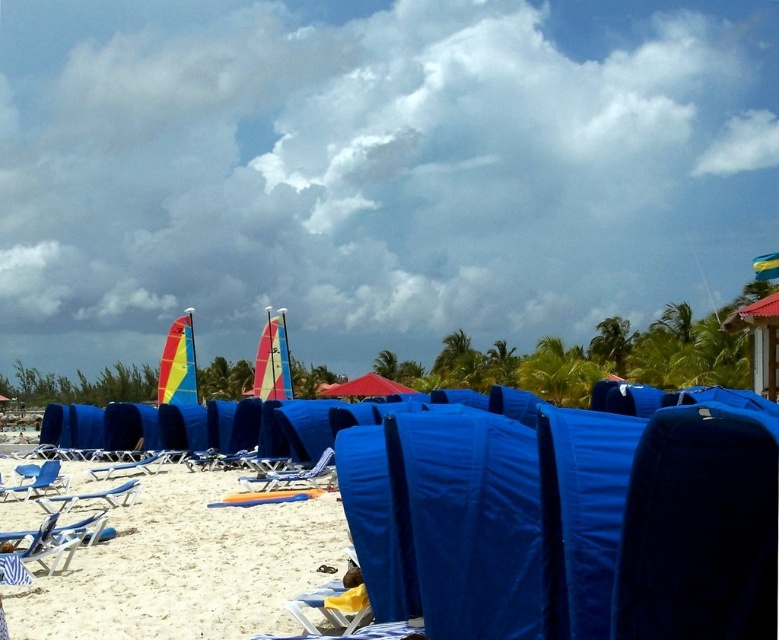
Looking at this image, can you confirm if white sandy beach at lower center is bigger than metallic blue lounge chair at center?

No, white sandy beach at lower center is not bigger than metallic blue lounge chair at center.

Who is positioned more to the left, white sandy beach at lower center or metallic blue lounge chair at center?

metallic blue lounge chair at center is more to the left.

Identify the location of white sandy beach at lower center. pyautogui.click(x=185, y=566).

The width and height of the screenshot is (779, 640). Find the location of `white sandy beach at lower center`. white sandy beach at lower center is located at coordinates (185, 566).

What do you see at coordinates (185, 566) in the screenshot?
I see `white sandy beach at lower center` at bounding box center [185, 566].

Between white sandy beach at lower center and blue fabric chair at lower left, which one is positioned lower?

Positioned lower is white sandy beach at lower center.

Who is more distant from viewer, (x=252, y=529) or (x=111, y=492)?

The point (x=111, y=492) is behind.

Where is `white sandy beach at lower center`? white sandy beach at lower center is located at coordinates coord(185,566).

Who is more distant from viewer, (397,392) or (129,468)?

Positioned behind is point (397,392).

Is point (333, 396) positioned behind point (152, 472)?

Yes, point (333, 396) is farther from viewer.

Which is in front, point (386, 394) or point (124, 467)?

Point (124, 467) is more forward.

What are the coordinates of `red fabric umbrella at center` in the screenshot? It's located at (365, 387).